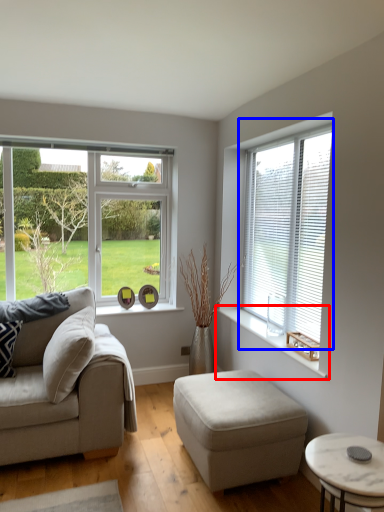
Question: Which object is closer to the camera taking this photo, window sill (highlighted by a red box) or window (highlighted by a blue box)?

Choices:
 (A) window sill
 (B) window

Answer: (A)